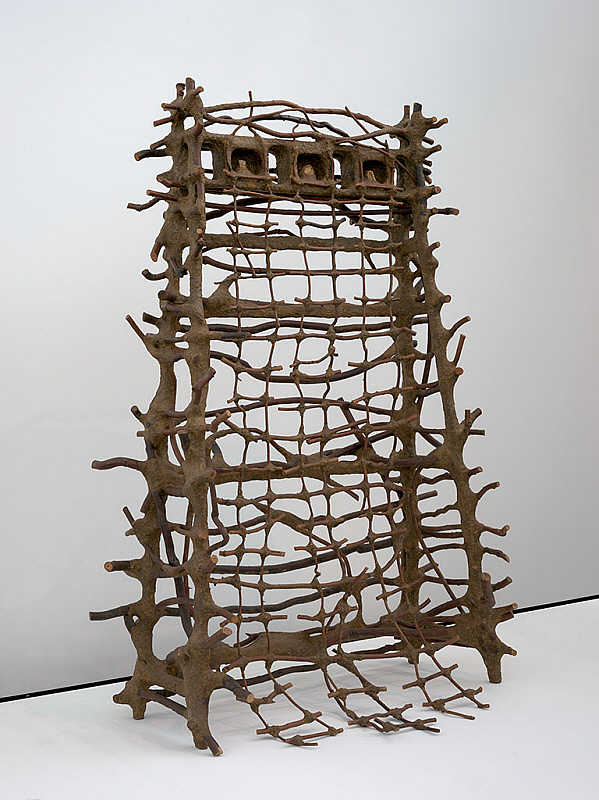
Where is `sculpture`? Image resolution: width=599 pixels, height=800 pixels. sculpture is located at coordinates (452, 434).